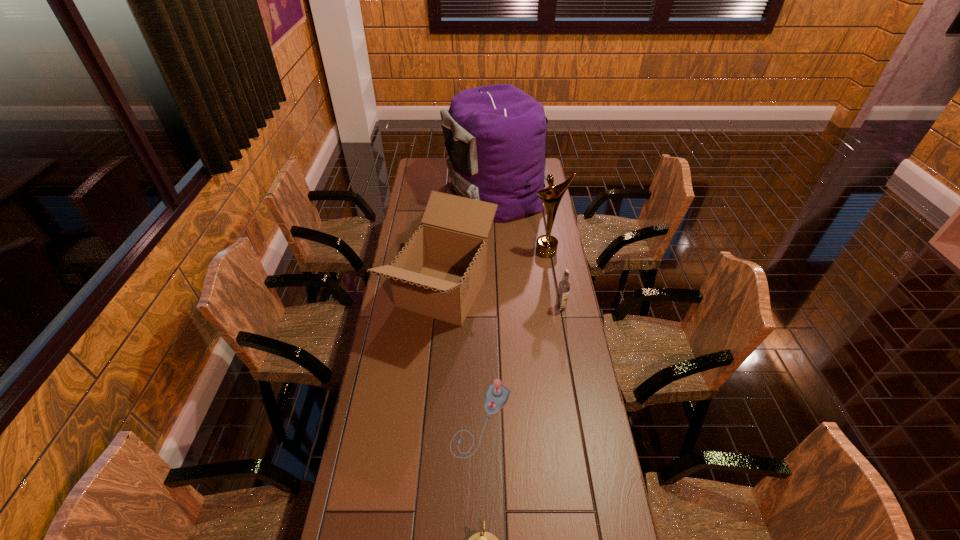
In the image, there is a desktop. Identify the location of vacant space at the left edge. The width and height of the screenshot is (960, 540). (410, 328).

The height and width of the screenshot is (540, 960). In the image, there is a desktop. In order to click on vacant space at the right edge in this screenshot , I will do `click(527, 221)`.

Identify the location of free space between the shortest object and the vodka. (521, 364).

Where is `free spot between the farthest object and the vodka`? free spot between the farthest object and the vodka is located at coordinates (529, 250).

This screenshot has width=960, height=540. Find the location of `unoccupied area between the second tallest object and the third tallest object`. unoccupied area between the second tallest object and the third tallest object is located at coordinates (494, 272).

At what (x,y) coordinates should I click in order to perform the action: click on vacant space in between the fifth shortest object and the fourth shortest object. Please return your answer as a coordinate pair (x, y). Looking at the image, I should click on (494, 272).

Locate an element on the screen. vacant area between the box and the award is located at coordinates (494, 272).

This screenshot has width=960, height=540. I want to click on free space between the award and the joystick, so click(x=515, y=336).

You are a GUI agent. You are given a task and a screenshot of the screen. Output one action in this format:
    pyautogui.click(x=<x>, y=<y>)
    Task: Click on the empty location between the box and the fifth farthest object
    
    Given the screenshot: What is the action you would take?
    pyautogui.click(x=462, y=356)

The height and width of the screenshot is (540, 960). What are the coordinates of `free space that is in between the second nearest object and the fourth tallest object` in the screenshot? It's located at (521, 364).